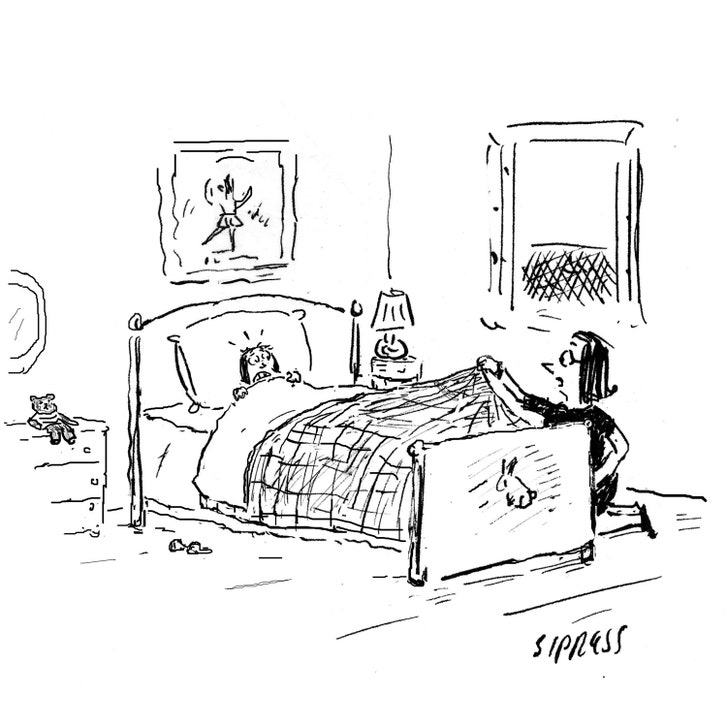
This screenshot has width=727, height=727. Identify the location of person lying in bed. (245, 361).